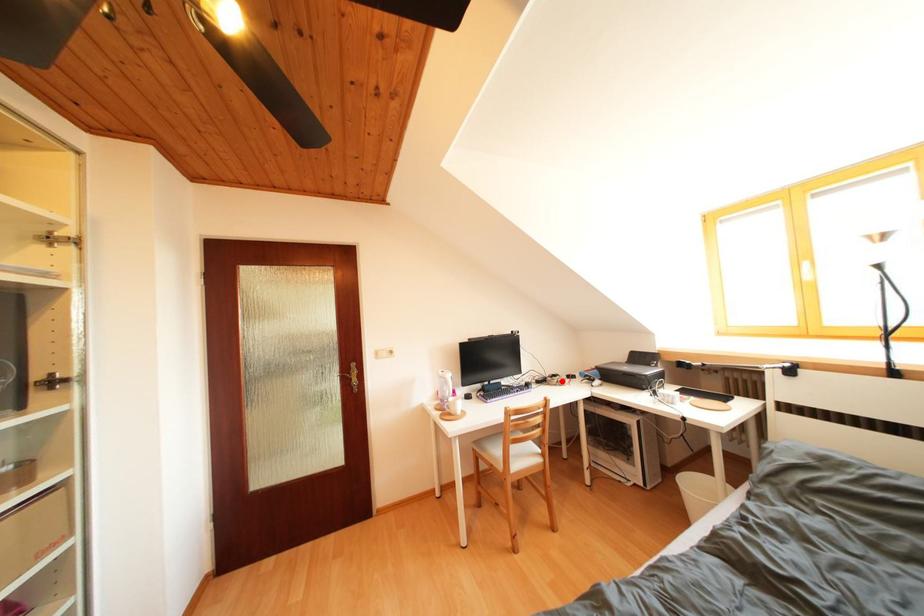
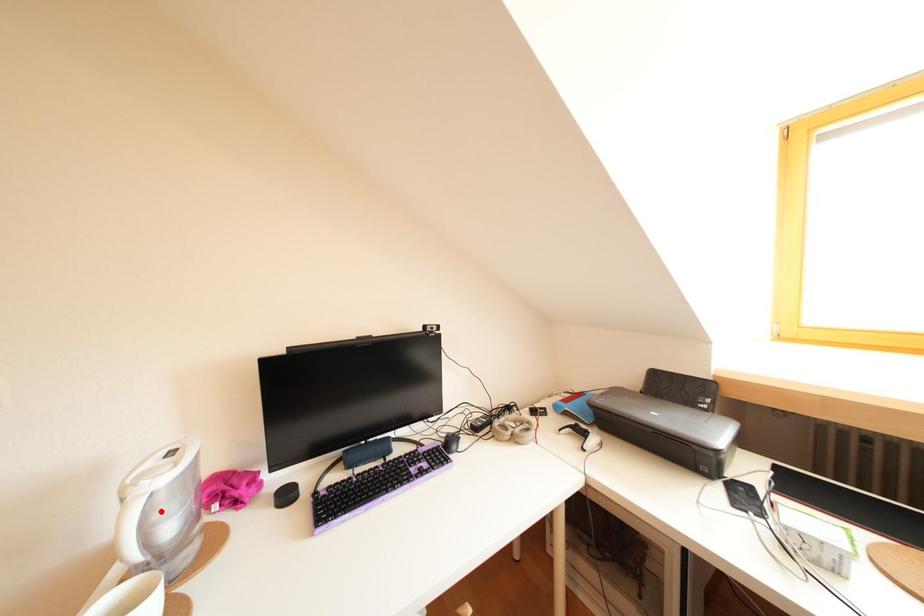
I am providing you with two images of the same scene from different viewpoints. A red point is marked on the first image and another point is marked on the second image. Does the point marked in image1 correspond to the same location as the one in image2?

No